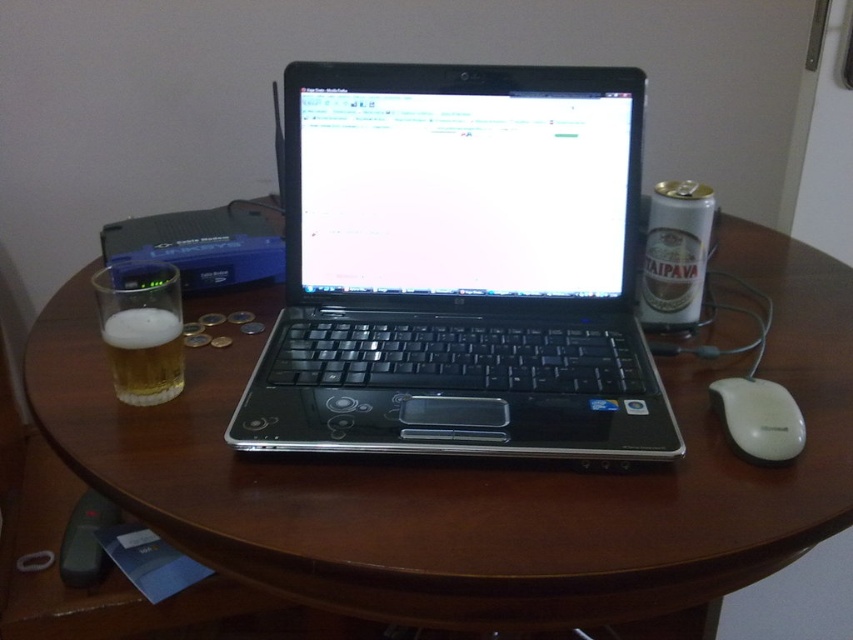
Question: Is foamy golden beer at left bigger than white plastic mouse at right?

Choices:
 (A) no
 (B) yes

Answer: (A)

Question: Which object is closer to the camera taking this photo?

Choices:
 (A) brown wood round table at center
 (B) black plastic laptop at center

Answer: (A)

Question: Among these objects, which one is farthest from the camera?

Choices:
 (A) foamy golden beer at left
 (B) brown wood round table at center
 (C) black plastic laptop at center
 (D) white plastic mouse at right

Answer: (A)

Question: Does black plastic laptop at center lie behind white plastic mouse at right?

Choices:
 (A) yes
 (B) no

Answer: (B)

Question: Which point appears farthest from the camera in this image?

Choices:
 (A) (720, 388)
 (B) (135, 316)

Answer: (B)

Question: Does brown wood round table at center appear over foamy golden beer at left?

Choices:
 (A) no
 (B) yes

Answer: (B)